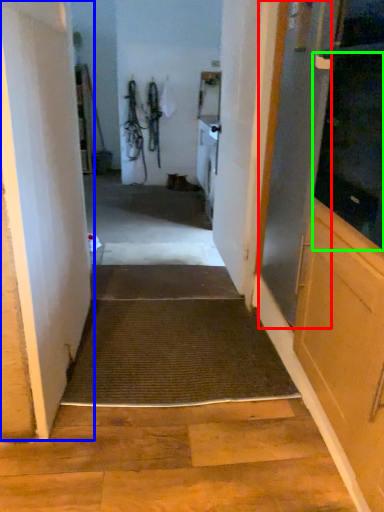
Question: Which is farther away from screen door (highlighted by a red box)? door (highlighted by a blue box) or screen door (highlighted by a green box)?

Choices:
 (A) door
 (B) screen door

Answer: (A)